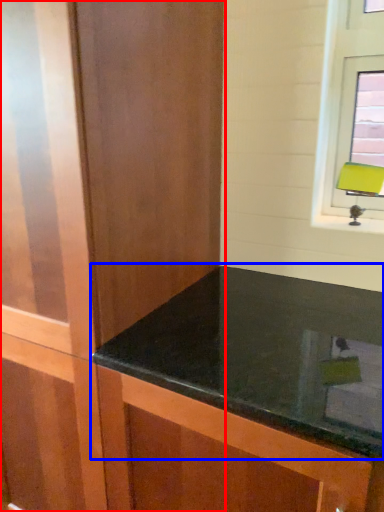
Question: Which object appears closest to the camera in this image, dresser (highlighted by a red box) or countertop (highlighted by a blue box)?

Choices:
 (A) dresser
 (B) countertop

Answer: (B)